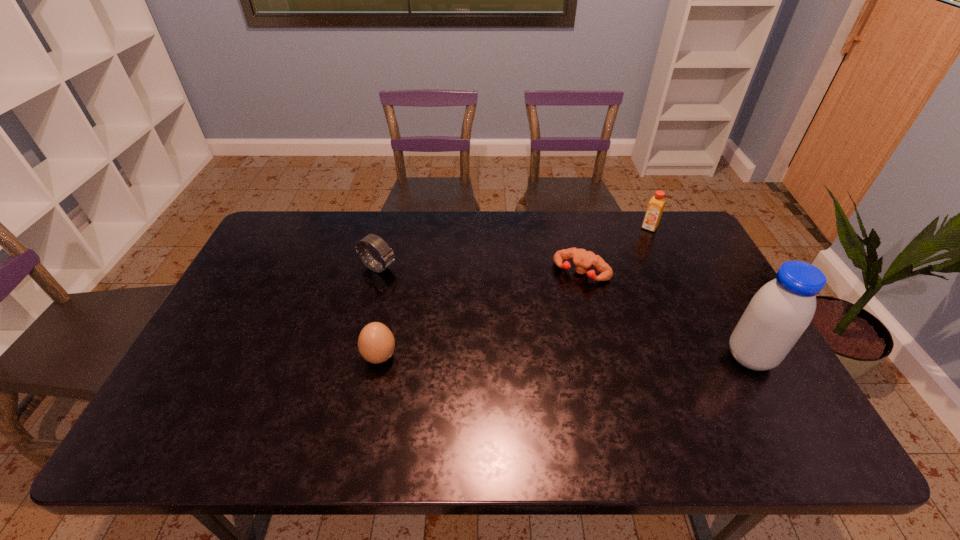
Image resolution: width=960 pixels, height=540 pixels. I want to click on boiled egg, so click(376, 343).

Find the location of a particular element. This screenshot has width=960, height=540. the tallest object is located at coordinates (778, 314).

In order to click on soya milk in this screenshot , I will do `click(778, 314)`.

At what (x,y) coordinates should I click in order to perform the action: click on the shortest object. Please return your answer as a coordinate pair (x, y). This screenshot has width=960, height=540. Looking at the image, I should click on (583, 259).

Locate an element on the screen. puncher is located at coordinates (583, 259).

Locate an element on the screen. The height and width of the screenshot is (540, 960). watch is located at coordinates (387, 256).

Identify the location of the farthest object. This screenshot has height=540, width=960. (656, 205).

Find the location of a particular element. the second object from right to left is located at coordinates (656, 205).

Find the location of a particular element. Image resolution: width=960 pixels, height=540 pixels. vacant space located on the back of the boiled egg is located at coordinates (392, 297).

Find the location of `vacant space located on the left of the soya milk`. vacant space located on the left of the soya milk is located at coordinates (609, 357).